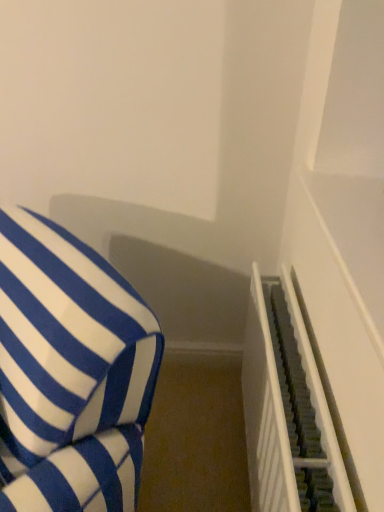
Question: Does dark gray textured stairwell at right have a smaller size compared to blue and white striped cushion at left?

Choices:
 (A) no
 (B) yes

Answer: (B)

Question: Is dark gray textured stairwell at right at the left side of blue and white striped cushion at left?

Choices:
 (A) no
 (B) yes

Answer: (A)

Question: From the image's perspective, would you say dark gray textured stairwell at right is positioned over blue and white striped cushion at left?

Choices:
 (A) no
 (B) yes

Answer: (A)

Question: Considering the relative sizes of dark gray textured stairwell at right and blue and white striped cushion at left in the image provided, is dark gray textured stairwell at right bigger than blue and white striped cushion at left?

Choices:
 (A) yes
 (B) no

Answer: (B)

Question: Is dark gray textured stairwell at right oriented away from blue and white striped cushion at left?

Choices:
 (A) no
 (B) yes

Answer: (A)

Question: Considering the relative sizes of dark gray textured stairwell at right and blue and white striped cushion at left in the image provided, is dark gray textured stairwell at right shorter than blue and white striped cushion at left?

Choices:
 (A) no
 (B) yes

Answer: (B)

Question: Can you confirm if blue and white striped cushion at left is wider than dark gray textured stairwell at right?

Choices:
 (A) no
 (B) yes

Answer: (B)

Question: Is blue and white striped cushion at left positioned before dark gray textured stairwell at right?

Choices:
 (A) yes
 (B) no

Answer: (A)

Question: From a real-world perspective, is blue and white striped cushion at left on top of dark gray textured stairwell at right?

Choices:
 (A) yes
 (B) no

Answer: (A)

Question: Does blue and white striped cushion at left turn towards dark gray textured stairwell at right?

Choices:
 (A) yes
 (B) no

Answer: (B)

Question: Is blue and white striped cushion at left positioned behind dark gray textured stairwell at right?

Choices:
 (A) yes
 (B) no

Answer: (B)

Question: Can you confirm if blue and white striped cushion at left is positioned to the left of dark gray textured stairwell at right?

Choices:
 (A) yes
 (B) no

Answer: (A)

Question: Looking at their shapes, would you say dark gray textured stairwell at right is wider or thinner than blue and white striped cushion at left?

Choices:
 (A) wide
 (B) thin

Answer: (B)